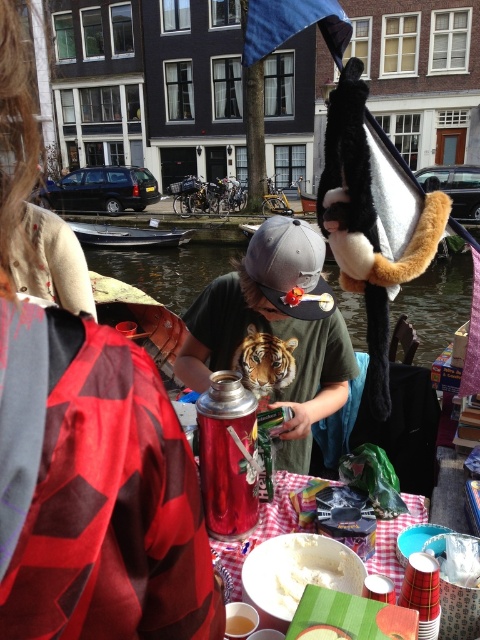
You are organizing a picnic and need to decide which item to place first in your bag. The flannel shirt at upper left and the metallic tiger head at center are both items you want to bring. Considering their sizes, which one should you pack first to ensure they both fit?

The flannel shirt at upper left is thinner than the metallic tiger head at center, so you should pack the metallic tiger head at center first to ensure there is enough space for the thinner flannel shirt at upper left.

You are a photographer standing at the camera position. You want to take a closeup shot of the flannel shirt at upper left. Is it within your camera range? The camera can focus on objects within 50 centimeters.

The flannel shirt at upper left is 47.44 centimeters from camera, so yes, it is within the camera range of 50 centimeters and can be focused on.

You are standing at point A which is at the same position as point (292, 580). There is a point B at (286, 506). If you want to walk towards point B, will you be moving forward or backward relative to your current position?

Since point (286, 506) is behind point (292, 580), moving towards point B would mean moving backward from your current position at point A.